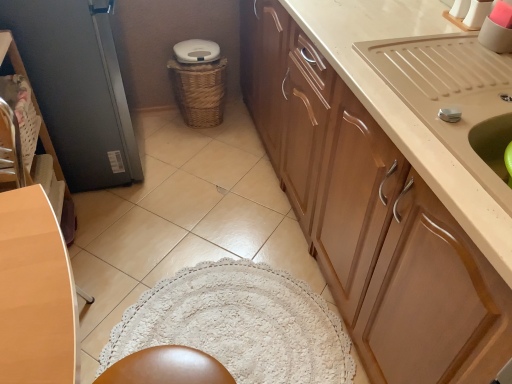
The image size is (512, 384). What are the coordinates of `free area behind matte brown chair at left` in the screenshot? It's located at (123, 276).